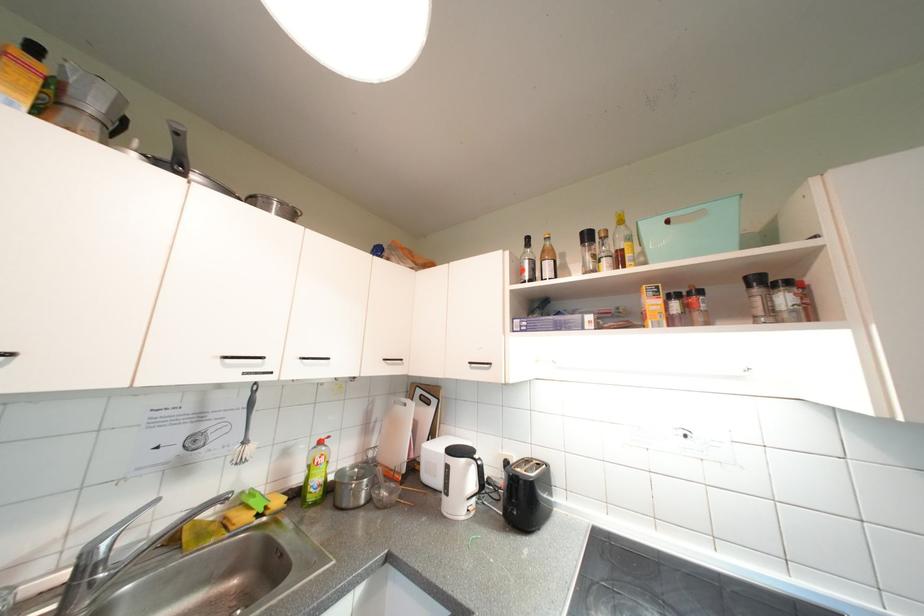
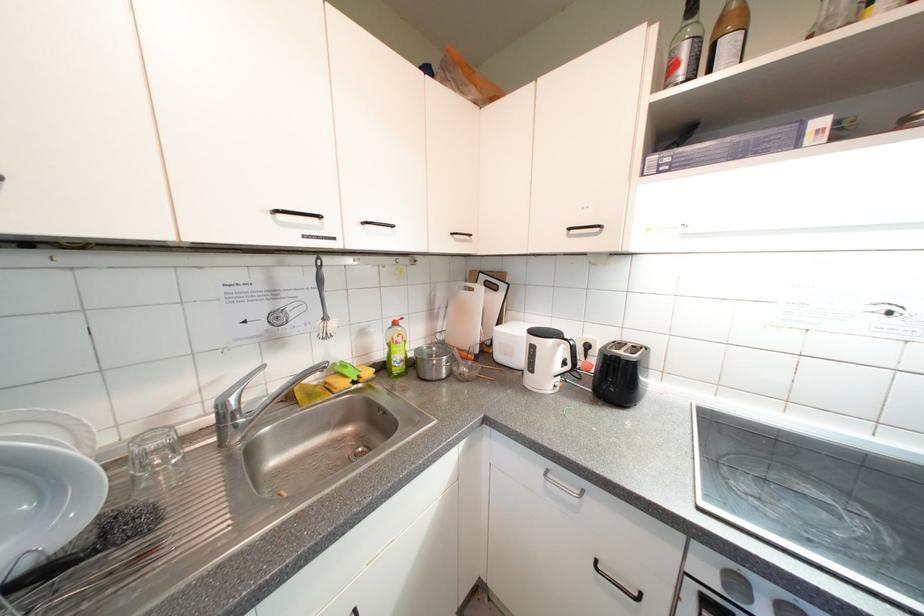
Find the pixel in the second image that matches point 311,361 in the first image.

(373, 225)